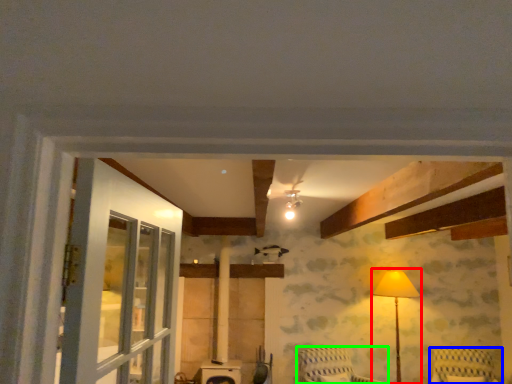
Question: Which is nearer to the table lamp (highlighted by a red box)? furniture (highlighted by a blue box) or furniture (highlighted by a green box).

Choices:
 (A) furniture
 (B) furniture

Answer: (A)